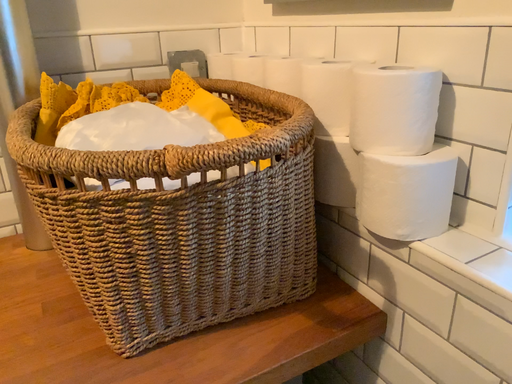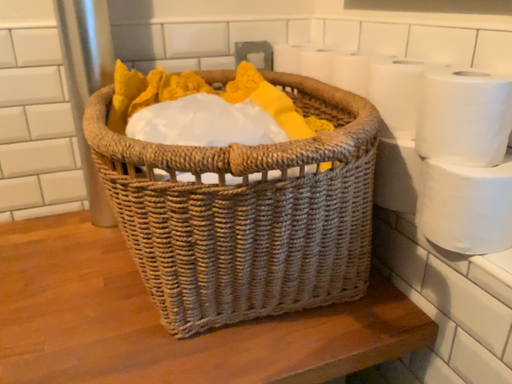
Question: How did the camera likely rotate when shooting the video?

Choices:
 (A) rotated left
 (B) rotated right

Answer: (A)